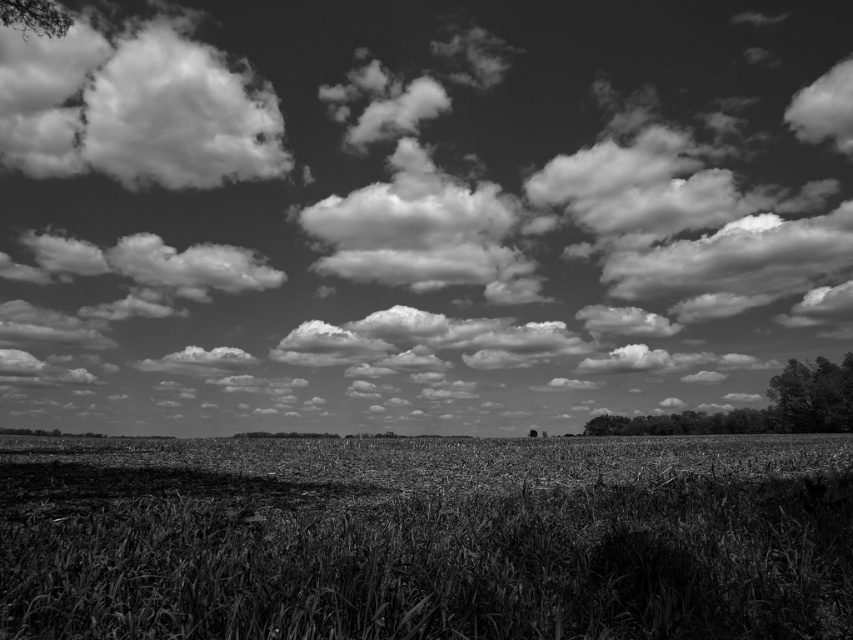
Question: Which object is the closest to the cloudy sky at upper center?

Choices:
 (A) dark green textured tree at right
 (B) dark textured tree at upper left

Answer: (B)

Question: Is cloudy sky at upper center thinner than dark green textured tree at right?

Choices:
 (A) yes
 (B) no

Answer: (B)

Question: Is grainy brown wheat field at center further to camera compared to smooth bark tree at right?

Choices:
 (A) yes
 (B) no

Answer: (B)

Question: Does fluffy white cloud at upper left come behind smooth bark tree at right?

Choices:
 (A) no
 (B) yes

Answer: (A)

Question: Which point is closer to the camera?

Choices:
 (A) dark textured tree at upper left
 (B) smooth bark tree at right
 (C) cloudy sky at upper center
 (D) grainy brown wheat field at center

Answer: (D)

Question: Which point appears farthest from the camera in this image?

Choices:
 (A) (827, 428)
 (B) (245, 124)

Answer: (A)